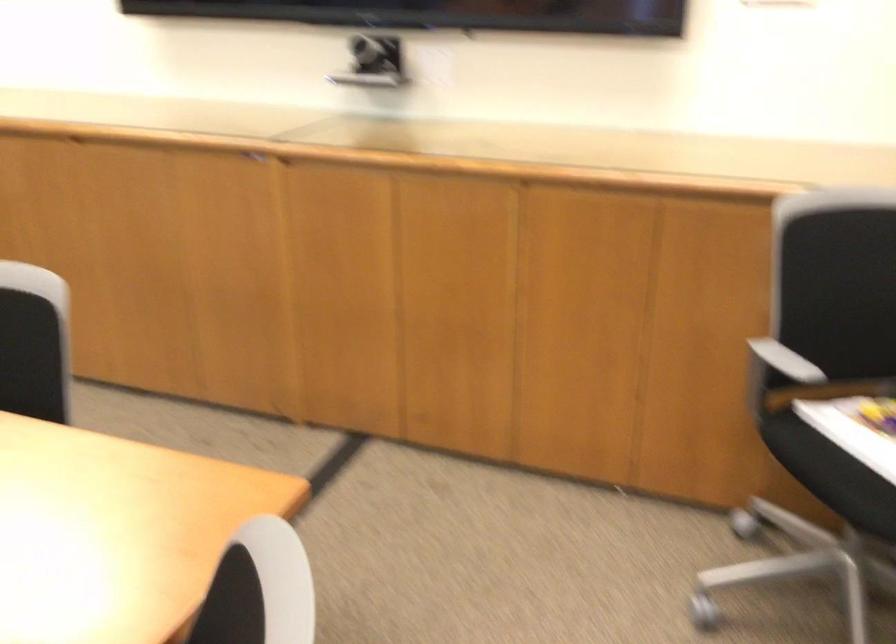
Find where to lift the white book. Please return your answer as a coordinate pair (x, y).

(857, 428)